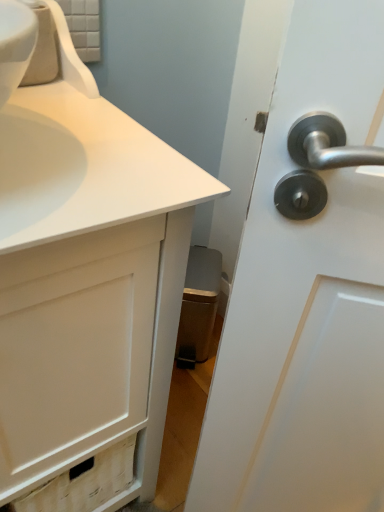
Question: Considering the positions of white glossy faucet at upper left and white matte cabinet at lower left in the image, is white glossy faucet at upper left taller or shorter than white matte cabinet at lower left?

Choices:
 (A) tall
 (B) short

Answer: (B)

Question: In terms of size, does white glossy faucet at upper left appear bigger or smaller than white matte cabinet at lower left?

Choices:
 (A) small
 (B) big

Answer: (A)

Question: Based on their positions, is white glossy faucet at upper left located to the left or right of white matte cabinet at lower left?

Choices:
 (A) left
 (B) right

Answer: (A)

Question: Is white matte cabinet at lower left spatially inside white glossy faucet at upper left, or outside of it?

Choices:
 (A) inside
 (B) outside

Answer: (B)

Question: Considering the positions of white matte cabinet at lower left and white glossy faucet at upper left in the image, is white matte cabinet at lower left bigger or smaller than white glossy faucet at upper left?

Choices:
 (A) small
 (B) big

Answer: (B)

Question: Is point (104, 214) positioned closer to the camera than point (89, 91)?

Choices:
 (A) farther
 (B) closer

Answer: (B)

Question: Is white matte cabinet at lower left taller or shorter than white glossy faucet at upper left?

Choices:
 (A) tall
 (B) short

Answer: (A)